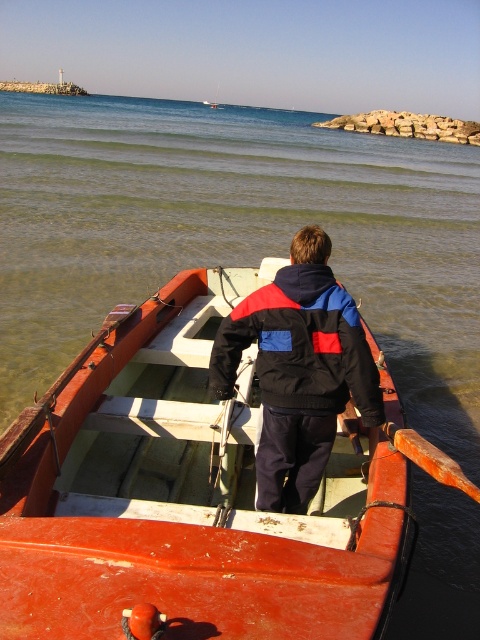
You are standing on the deck of the smooth wood boat at center and need to lower a fishing line into the water. Considering the height of the boat compared to the black nylon jacket at center, will the fishing line reach the water easily?

The smooth wood boat at center is taller than the black nylon jacket at center. Since the jacket is on the person standing on the boat, the height difference means the deck is elevated enough that lowering the fishing line should reach the water without difficulty.

You are standing on the smooth wood boat at center. There are two sailboats visible on the horizon. How far apart are the two sailboats?

The two sailboats are 5.94 feet apart.

You are a passenger on the smooth wood boat at center and need to store your black nylon jacket at center in a bag that can only hold items smaller than the boat. Will your jacket fit?

The smooth wood boat at center is larger in size than the black nylon jacket at center, so the jacket will fit in the bag.